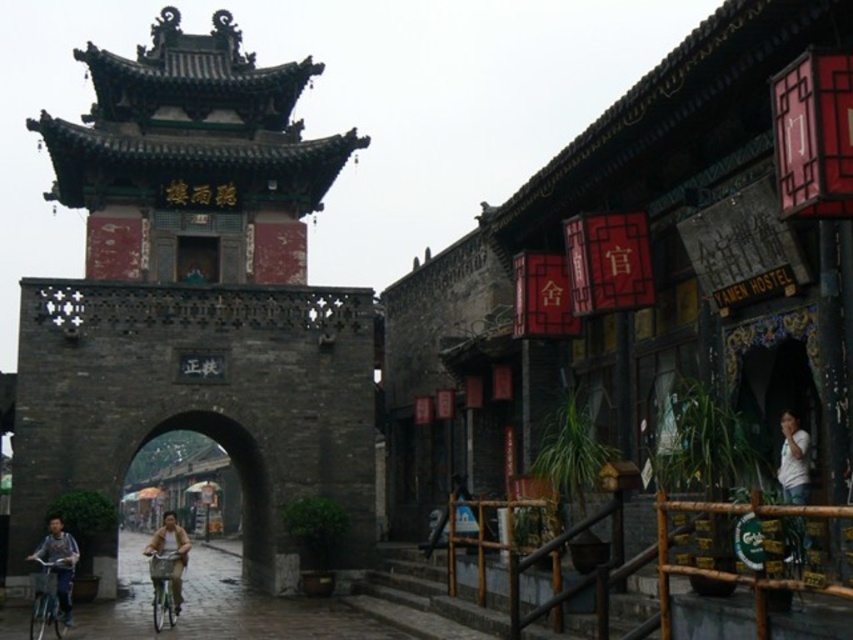
Question: Estimate the real-world distances between objects in this image. Which object is closer to the white cotton shirt at lower right?

Choices:
 (A) blue denim jacket at lower left
 (B) dark gray stone archway at center
 (C) bamboo/rustic wood railing at lower right

Answer: (C)

Question: Is bamboo/rustic wood railing at lower right to the left of light brown leather jacket at center from the viewer's perspective?

Choices:
 (A) yes
 (B) no

Answer: (B)

Question: Does blue denim jacket at lower left appear on the left side of light brown leather jacket at center?

Choices:
 (A) no
 (B) yes

Answer: (A)

Question: Estimate the real-world distances between objects in this image. Which object is farther from the bamboo/rustic wood railing at lower right?

Choices:
 (A) white cotton shirt at lower right
 (B) dark gray stone tower at center
 (C) light brown leather jacket at center

Answer: (B)

Question: Which object appears closest to the camera in this image?

Choices:
 (A) light brown leather jacket at center
 (B) dark gray stone archway at center
 (C) dark gray stone tower at center

Answer: (A)

Question: Can you confirm if dark gray stone tower at center is positioned above light brown leather jacket at center?

Choices:
 (A) yes
 (B) no

Answer: (A)